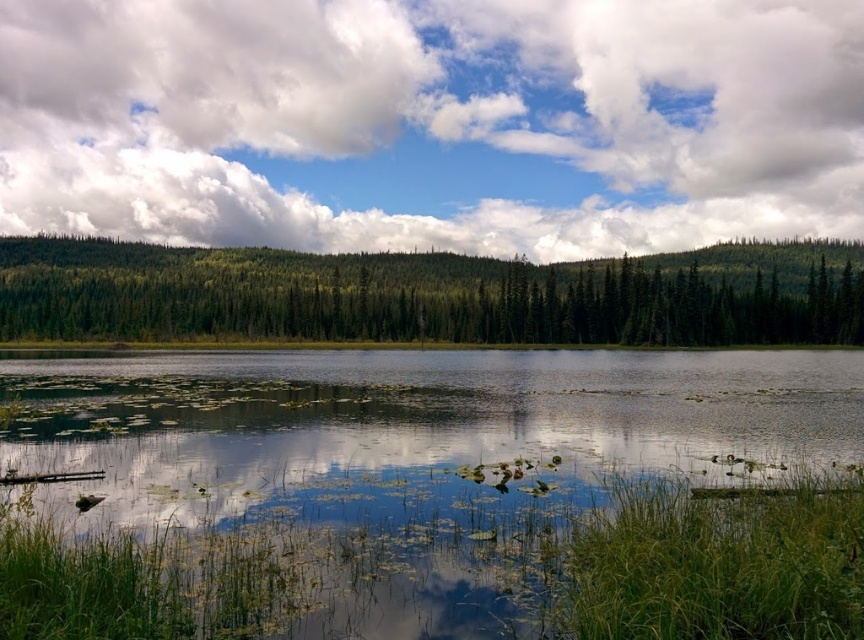
Question: Can you confirm if white fluffy cloud at upper center is thinner than green matte forest at center?

Choices:
 (A) yes
 (B) no

Answer: (B)

Question: Is white fluffy cloud at upper center below transparent water at center?

Choices:
 (A) yes
 (B) no

Answer: (B)

Question: Which point appears closest to the camera in this image?

Choices:
 (A) (359, 401)
 (B) (693, 292)

Answer: (A)

Question: Is transparent water at center below green matte forest at center?

Choices:
 (A) no
 (B) yes

Answer: (B)

Question: Which point appears farthest from the camera in this image?

Choices:
 (A) (621, 67)
 (B) (650, 280)

Answer: (A)

Question: Among these objects, which one is nearest to the camera?

Choices:
 (A) green matte forest at center
 (B) transparent water at center
 (C) white fluffy cloud at upper center

Answer: (B)